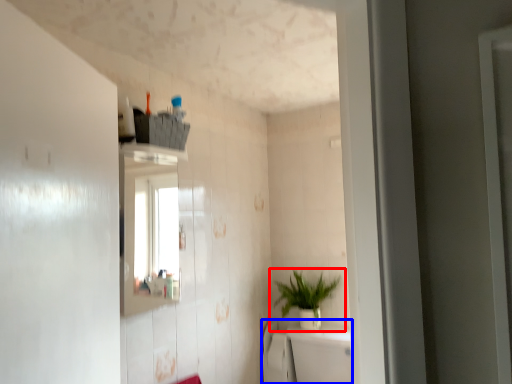
Question: Which point is closer to the camera, houseplant (highlighted by a red box) or bath (highlighted by a blue box)?

Choices:
 (A) houseplant
 (B) bath

Answer: (B)